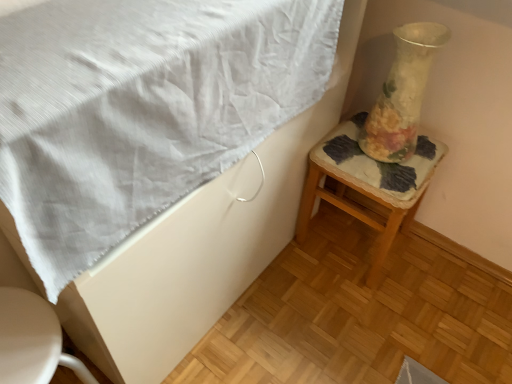
Where is `unoccupied region to the right of wooden stool with floral cushion at right`? The image size is (512, 384). unoccupied region to the right of wooden stool with floral cushion at right is located at coordinates (438, 275).